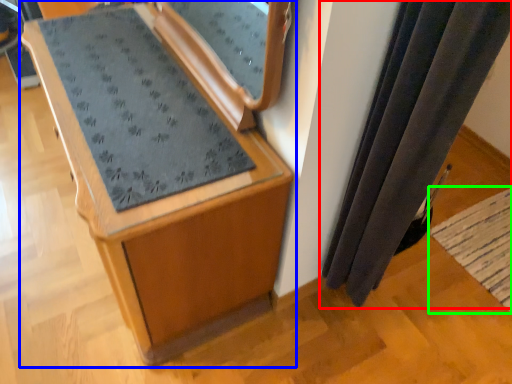
Question: Which is nearer to the curtain (highlighted by a red box)? furniture (highlighted by a blue box) or mat (highlighted by a green box).

Choices:
 (A) furniture
 (B) mat

Answer: (A)